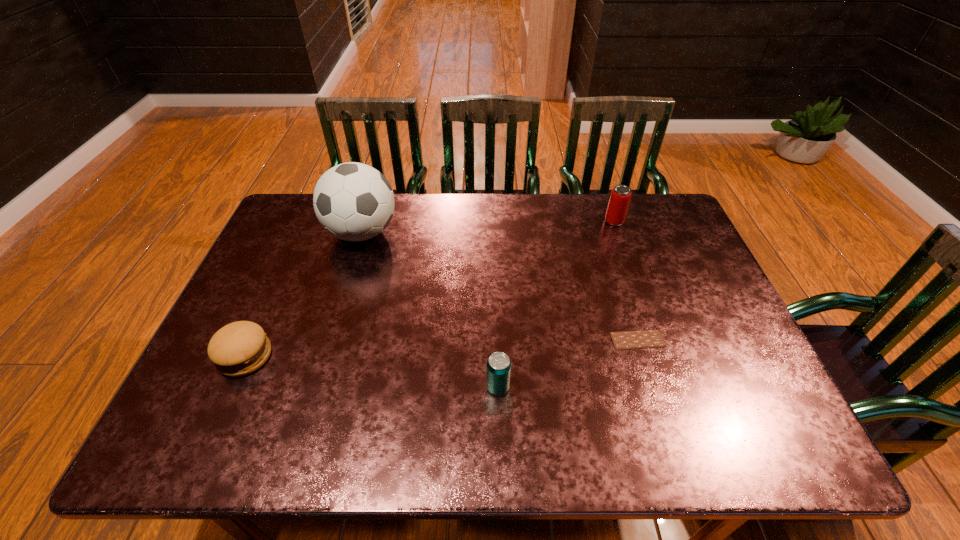
The image size is (960, 540). I want to click on vacant space located on the left of the farther beer can, so click(535, 221).

Locate an element on the screen. This screenshot has width=960, height=540. vacant space located on the right of the left beer can is located at coordinates (679, 387).

Find the location of `vacant space located 0.080m on the back of the hamburger`. vacant space located 0.080m on the back of the hamburger is located at coordinates (266, 312).

This screenshot has height=540, width=960. Identify the location of free space located on the back of the shortest object. (606, 239).

Where is `soccer ball at the far edge`? The height and width of the screenshot is (540, 960). soccer ball at the far edge is located at coordinates (353, 201).

The height and width of the screenshot is (540, 960). In order to click on beer can positioned at the far edge in this screenshot , I will do click(620, 197).

This screenshot has height=540, width=960. Find the location of `soccer ball at the left edge`. soccer ball at the left edge is located at coordinates (353, 201).

Identify the location of hamburger at the left edge. The image size is (960, 540). (240, 348).

Image resolution: width=960 pixels, height=540 pixels. Find the location of `object present at the far left corner`. object present at the far left corner is located at coordinates (353, 201).

Locate an element on the screen. The height and width of the screenshot is (540, 960). free region at the far edge of the desktop is located at coordinates (394, 221).